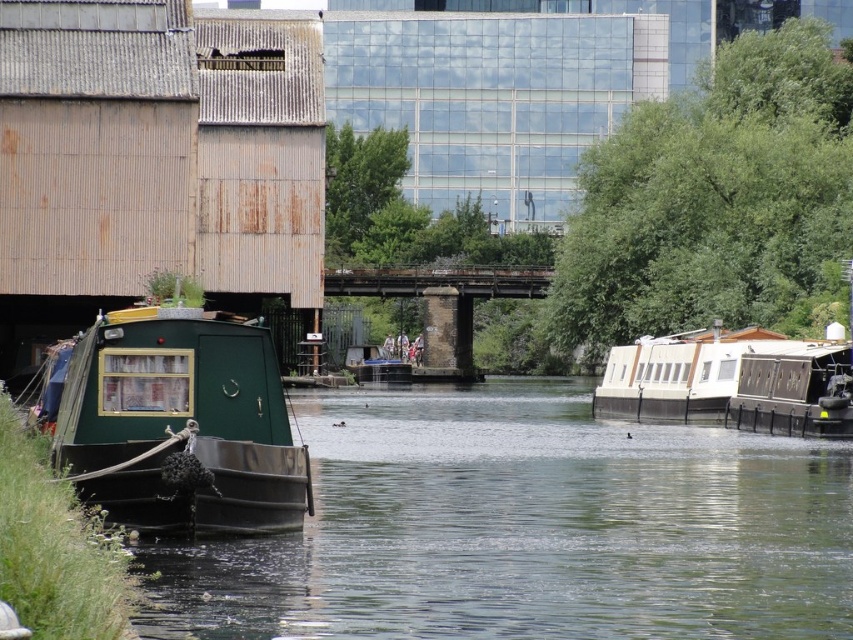
Find the location of a particular element. The image size is (853, 640). green matte boat at left is located at coordinates (527, 529).

Consider the image. Between green matte boat at left and white glossy houseboat at right, which one appears on the left side from the viewer's perspective?

green matte boat at left is more to the left.

Does point (410, 618) come behind point (767, 432)?

No, it is not.

What are the coordinates of `green matte boat at left` in the screenshot? It's located at (527, 529).

Is point (264, 406) more distant than point (810, 392)?

No, it is not.

Does green matte houseboat at left appear over white glossy houseboat at right?

No, green matte houseboat at left is not above white glossy houseboat at right.

Does point (172, 492) come in front of point (787, 388)?

Yes.

This screenshot has width=853, height=640. What are the coordinates of `green matte houseboat at left` in the screenshot? It's located at 180,424.

Where is `green matte boat at left`? This screenshot has width=853, height=640. green matte boat at left is located at coordinates (527, 529).

Is point (502, 483) positioned behind point (149, 506)?

Yes, point (502, 483) is behind point (149, 506).

Is point (744, 477) closer to viewer compared to point (178, 488)?

No, it is behind (178, 488).

You are a GUI agent. You are given a task and a screenshot of the screen. Output one action in this format:
    pyautogui.click(x=<x>, y=<y>)
    Task: Click on the green matte boat at left
    
    Given the screenshot: What is the action you would take?
    pyautogui.click(x=527, y=529)